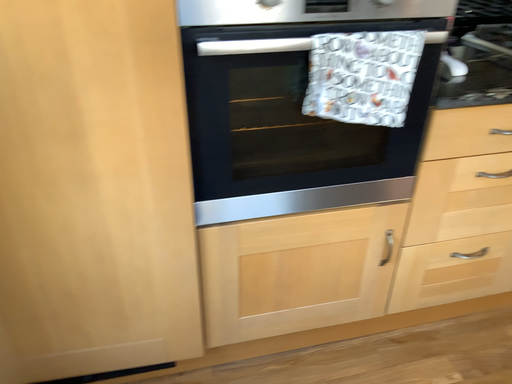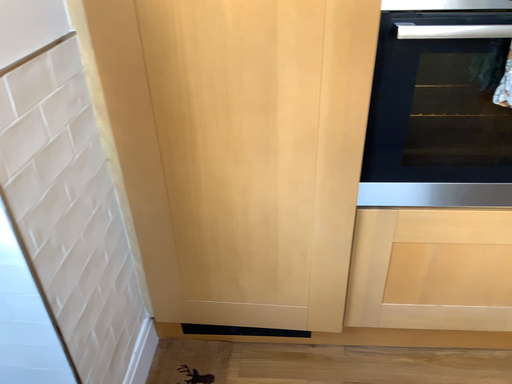
Question: Which way did the camera rotate in the video?

Choices:
 (A) rotated left
 (B) rotated right

Answer: (A)